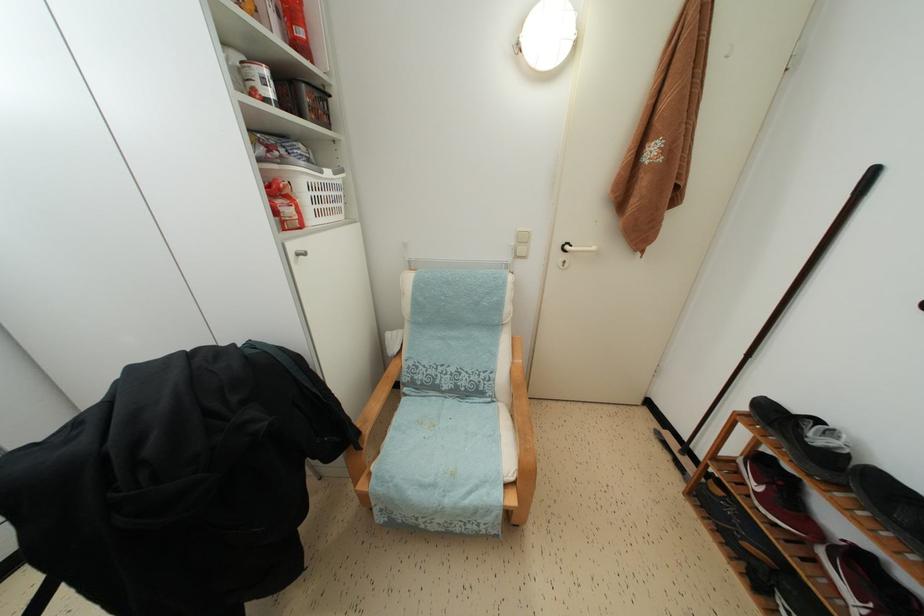
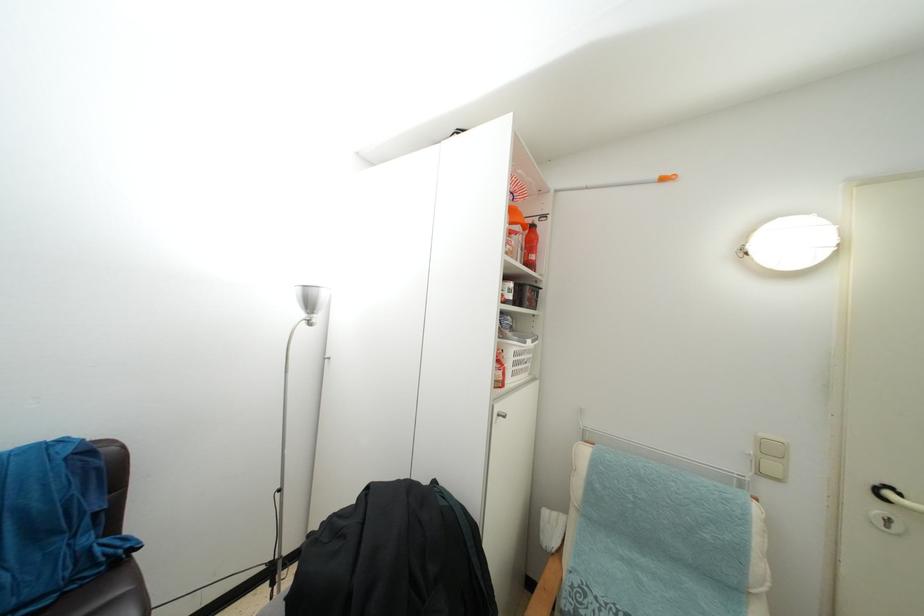
Locate, in the second image, the point that corresponds to point 319,206 in the first image.

(519, 370)